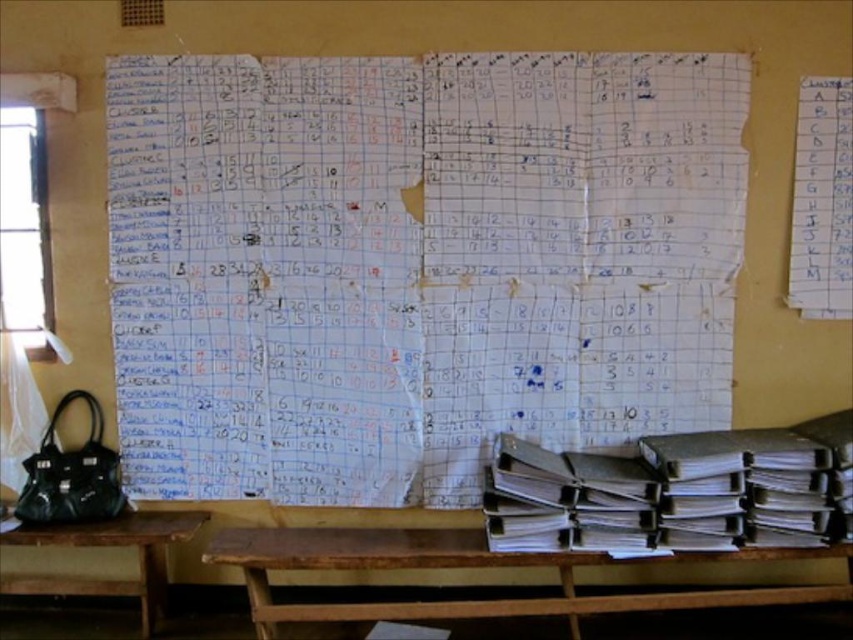
You are a student sitting at the brown wooden table at lower left and want to look at the white paper at center. Can you see it clearly without moving your head?

The white paper at center is further to the viewer than brown wooden table at lower left, so the white paper at center is closer to you than the table you are sitting at. This means the paper is between you and the wall, potentially blocking your view. Therefore, you might not be able to see it clearly without moving your head.

You are a student trying to hang a poster on the wall. The poster is as wide as the brown wooden table at lower left. Will it fit on the white paper at center?

The white paper at center might be wider than brown wooden table at lower left, so the poster could potentially fit if its width matches the table. However, since the exact dimensions aren

You are a student sitting in the classroom and want to reach the brown wooden table at lower center and the brown wooden table at lower left. Which table is closer to you?

The brown wooden table at lower center is closer to you than the brown wooden table at lower left.